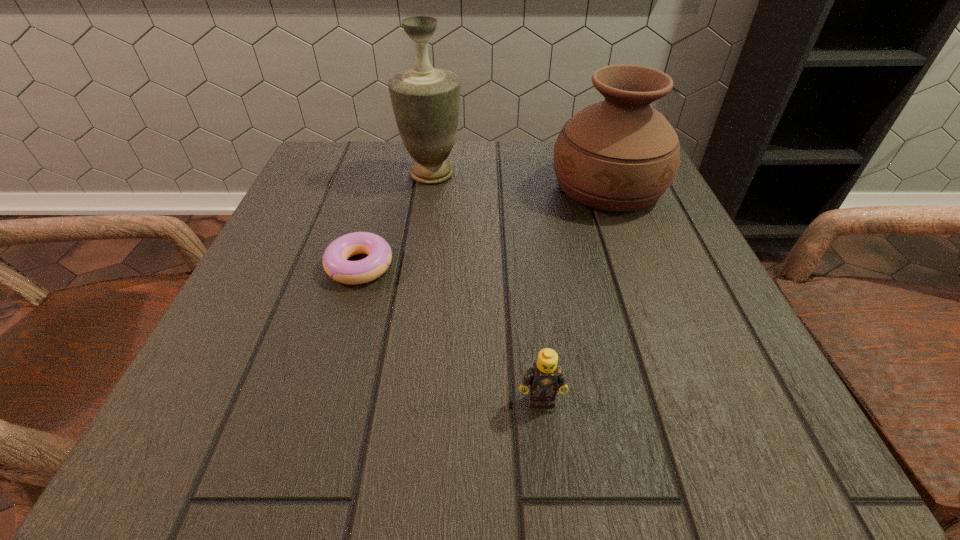
Identify the location of vacant point located between the left urn and the second tallest object. (520, 180).

Image resolution: width=960 pixels, height=540 pixels. What are the coordinates of `vacant area that lies between the second object from right to left and the tallest object` in the screenshot? It's located at (487, 287).

At what (x,y) coordinates should I click in order to perform the action: click on object that can be found as the second closest to the tallest object. Please return your answer as a coordinate pair (x, y). The height and width of the screenshot is (540, 960). Looking at the image, I should click on (620, 154).

Identify which object is the third closest to the tallest object. Please provide its 2D coordinates. Your answer should be formatted as a tuple, i.e. [(x, y)], where the tuple contains the x and y coordinates of a point satisfying the conditions above.

[(544, 376)]

The width and height of the screenshot is (960, 540). I want to click on vacant position in the image that satisfies the following two spatial constraints: 1. on the front side of the shorter urn; 2. on the right side of the taller urn, so click(x=430, y=187).